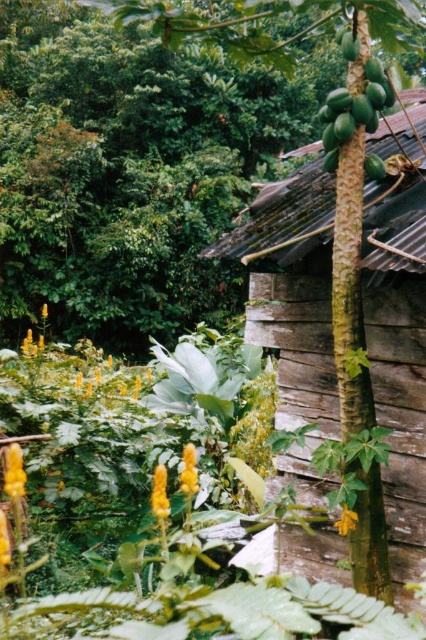
From the picture: You are standing in the rustic outdoor scene and want to take a photo of the green matte banana tree at center. If your camera has a maximum focus range of 3 meters, will it be able to capture the tree clearly?

The green matte banana tree at center is 3.14 meters away from the camera. Since the camera can only focus up to 3 meters, it won

You are an explorer in the jungle and see the wooden hut at right and the green papaya at center. Which object is closer to you?

The wooden hut at right is closer to you because the green papaya at center is behind it.

You are planning to plant a new flower bed in your garden. You have both the green matte banana tree at center and the green papaya at center. Which one takes up more space in the garden?

The green papaya at center occupies more space than the green matte banana tree at center according to the description.